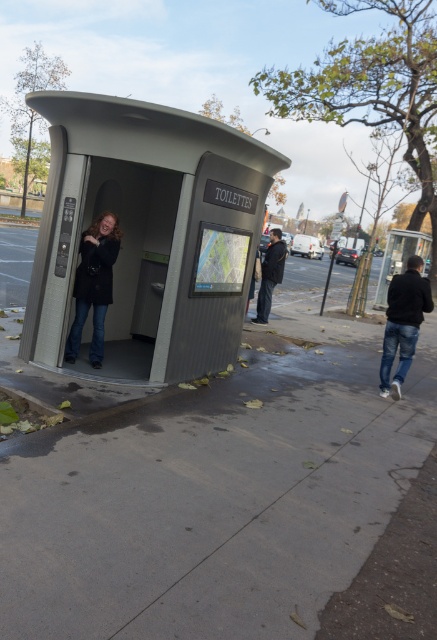
You are a pedestrian trying to cross the street safely. You see a black matte jacket at lower right and dark blue jeans at center. Which one is closer to you?

The black matte jacket at lower right is closer to the viewer than dark blue jeans at center.

You are a pedestrian trying to cross the street safely. You see a black matte jacket at lower right and dark blue jeans at center. Which clothing item is closer to the street?

The black matte jacket at lower right is positioned under dark blue jeans at center, meaning it is closer to the street.

You are standing at the entrance of the public restroom and want to greet the two men walking away from you. The black matte jacket at lower right and dark blue jeans at center are part of their clothing. Considering the distance between them, can you shout loud enough to reach both of them if your shouting range is 10 feet?

The black matte jacket at lower right is 12.74 feet from dark blue jeans at center. Since your shouting range is 10 feet, you cannot reach both of them as the distance exceeds your range.